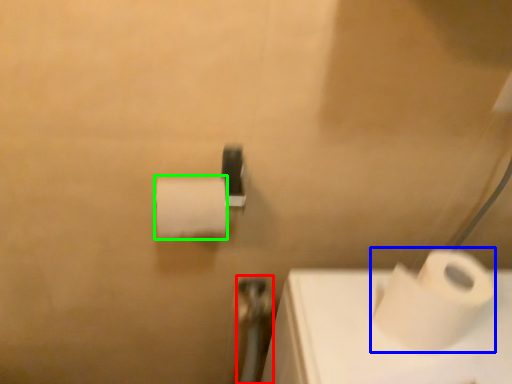
Question: Estimate the real-world distances between objects in this image. Which object is closer to shower (highlighted by a red box), toilet paper (highlighted by a blue box) or toilet paper (highlighted by a green box)?

Choices:
 (A) toilet paper
 (B) toilet paper

Answer: (B)